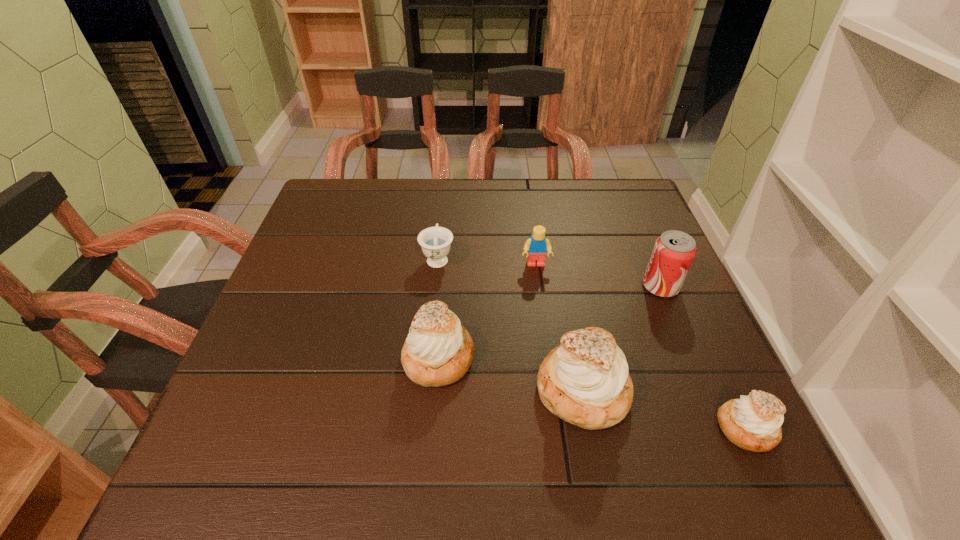
Where is `vacant space located on the side of the teacup with the handle`? The image size is (960, 540). vacant space located on the side of the teacup with the handle is located at coordinates (445, 183).

The height and width of the screenshot is (540, 960). I want to click on vacant area situated on the side of the teacup with the handle, so click(x=444, y=206).

Locate an element on the screen. The width and height of the screenshot is (960, 540). vacant space located 0.160m on the front-facing side of the Lego is located at coordinates (543, 320).

Find the location of a particular element. The image size is (960, 540). free point located 0.260m on the back of the fourth nearest object is located at coordinates (629, 211).

What are the coordinates of `pastry present at the right edge` in the screenshot? It's located at (753, 422).

I want to click on soda can at the right edge, so click(674, 251).

Find the location of a particular element. object located in the near right corner section of the desktop is located at coordinates (753, 422).

Image resolution: width=960 pixels, height=540 pixels. Identify the location of vacant space at the far edge. click(x=377, y=206).

In the image, there is a desktop. At what (x,y) coordinates should I click in order to perform the action: click on vacant area at the near edge. Please return your answer as a coordinate pair (x, y). Looking at the image, I should click on (390, 397).

In the image, there is a desktop. At what (x,y) coordinates should I click in order to perform the action: click on vacant space at the left edge. Please return your answer as a coordinate pair (x, y). The width and height of the screenshot is (960, 540). Looking at the image, I should click on (349, 252).